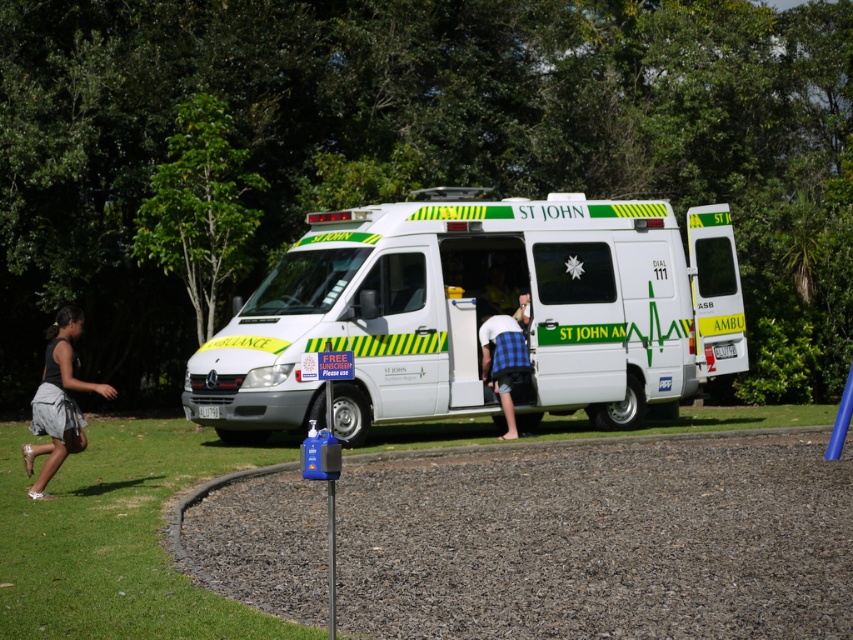
Is white glossy ambulance at center wider than blue plaid shirt at center?

No.

Image resolution: width=853 pixels, height=640 pixels. What do you see at coordinates (479, 314) in the screenshot?
I see `white glossy ambulance at center` at bounding box center [479, 314].

Find the location of a particular element. This screenshot has height=640, width=853. white glossy ambulance at center is located at coordinates (479, 314).

I want to click on white glossy ambulance at center, so click(479, 314).

Which is more to the right, gray cotton skirt at lower left or blue plaid shirt at center?

From the viewer's perspective, blue plaid shirt at center appears more on the right side.

How distant is gray cotton skirt at lower left from blue plaid shirt at center?

The distance of gray cotton skirt at lower left from blue plaid shirt at center is 6.69 meters.

Is point (74, 330) farther from camera compared to point (492, 349)?

No, (74, 330) is closer to viewer.

This screenshot has height=640, width=853. Identify the location of gray cotton skirt at lower left. (57, 401).

Is white glossy ambulance at center to the left of gray cotton skirt at lower left from the viewer's perspective?

In fact, white glossy ambulance at center is to the right of gray cotton skirt at lower left.

Is point (527, 282) closer to camera compared to point (67, 310)?

No, it is behind (67, 310).

Identify the location of white glossy ambulance at center. (479, 314).